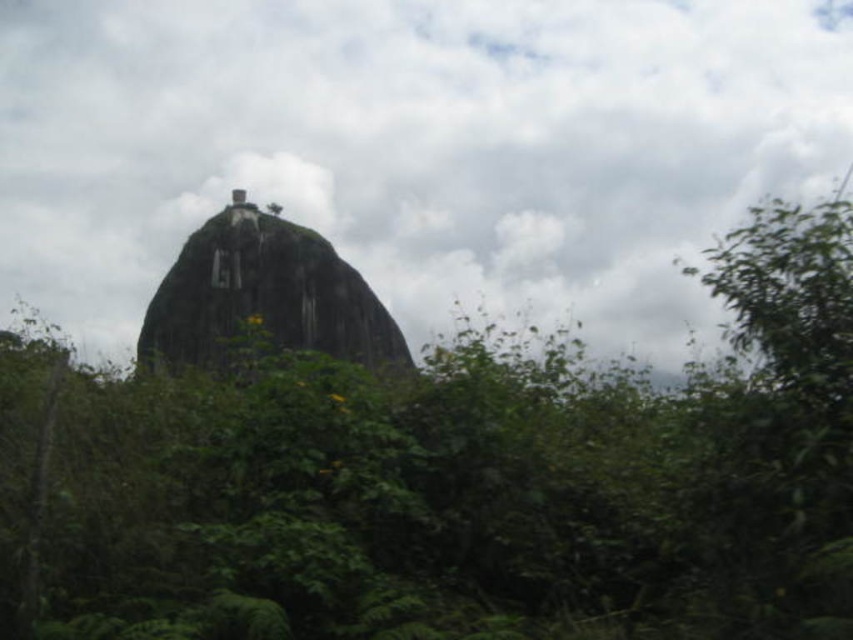
Question: Estimate the real-world distances between objects in this image. Which object is farther from the green rough rock at center?

Choices:
 (A) green leafy tree at center
 (B) white fluffy cloud at upper center

Answer: (B)

Question: Does green leafy tree at center have a greater width compared to white fluffy cloud at upper center?

Choices:
 (A) yes
 (B) no

Answer: (B)

Question: Which object appears farthest from the camera in this image?

Choices:
 (A) green rough rock at center
 (B) green leafy tree at center

Answer: (A)

Question: Where is white fluffy cloud at upper center located in relation to green rough rock at center in the image?

Choices:
 (A) right
 (B) left

Answer: (B)

Question: Observing the image, what is the correct spatial positioning of green leafy tree at center in reference to white fluffy cloud at upper center?

Choices:
 (A) left
 (B) right

Answer: (B)

Question: Which object is the farthest from the green rough rock at center?

Choices:
 (A) green leafy tree at center
 (B) white fluffy cloud at upper center

Answer: (B)